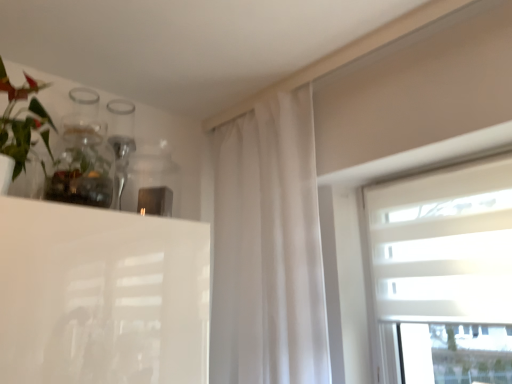
The height and width of the screenshot is (384, 512). Describe the element at coordinates (444, 273) in the screenshot. I see `white textured blinds at upper right` at that location.

The width and height of the screenshot is (512, 384). What do you see at coordinates (268, 248) in the screenshot?
I see `white sheer curtain at center` at bounding box center [268, 248].

What do you see at coordinates (82, 156) in the screenshot? The height and width of the screenshot is (384, 512). I see `clear glass vase at upper left` at bounding box center [82, 156].

You are a GUI agent. You are given a task and a screenshot of the screen. Output one action in this format:
    pyautogui.click(x=<x>, y=<y>)
    Task: Click on the clear glass vase at upper left
    The width and height of the screenshot is (512, 384).
    Given the screenshot: What is the action you would take?
    pyautogui.click(x=82, y=156)

Where is `green matte plant at upper left`? Image resolution: width=512 pixels, height=384 pixels. green matte plant at upper left is located at coordinates (61, 147).

In terms of height, does clear glass vase at upper left look taller or shorter compared to white textured blinds at upper right?

Considering their sizes, clear glass vase at upper left has less height than white textured blinds at upper right.

Measure the distance between clear glass vase at upper left and white textured blinds at upper right.

clear glass vase at upper left is 3.44 feet away from white textured blinds at upper right.

Is clear glass vase at upper left to the left of white textured blinds at upper right from the viewer's perspective?

Correct, you'll find clear glass vase at upper left to the left of white textured blinds at upper right.

Is clear glass vase at upper left located outside white textured blinds at upper right?

Absolutely, clear glass vase at upper left is external to white textured blinds at upper right.

From a real-world perspective, is white sheer curtain at center on top of clear glass vase at upper left?

No.

In the scene shown: Is white sheer curtain at center next to clear glass vase at upper left?

No, white sheer curtain at center is not beside clear glass vase at upper left.

Consider the image. Considering the sizes of objects white sheer curtain at center and clear glass vase at upper left in the image provided, who is thinner, white sheer curtain at center or clear glass vase at upper left?

Thinner between the two is clear glass vase at upper left.

Is clear glass vase at upper left inside white sheer curtain at center?

No, white sheer curtain at center does not contain clear glass vase at upper left.

From a real-world perspective, is clear glass vase at upper left physically below white sheer curtain at center?

No, from a real-world perspective, clear glass vase at upper left is not under white sheer curtain at center.

Is clear glass vase at upper left not close to white sheer curtain at center?

No, clear glass vase at upper left is not far away from white sheer curtain at center.

In the image, is clear glass vase at upper left on the left side or the right side of white sheer curtain at center?

clear glass vase at upper left is to the left of white sheer curtain at center.

Is point (78, 196) behind point (238, 316)?

No, it is in front of (238, 316).

Looking at this image, considering the relative sizes of white textured blinds at upper right and clear glass vase at upper left in the image provided, is white textured blinds at upper right shorter than clear glass vase at upper left?

Incorrect, the height of white textured blinds at upper right does not fall short of that of clear glass vase at upper left.

Is white textured blinds at upper right looking in the opposite direction of clear glass vase at upper left?

white textured blinds at upper right is not turned away from clear glass vase at upper left.

Which is closer to the camera, (415, 237) or (63, 147)?

Clearly, point (415, 237) is more distant from the camera than point (63, 147).

Measure the distance from white textured blinds at upper right to clear glass vase at upper left.

A distance of 1.05 meters exists between white textured blinds at upper right and clear glass vase at upper left.

Locate an element on the screen. This screenshot has height=384, width=512. window that appears below the green matte plant at upper left (from a real-world perspective) is located at coordinates (444, 273).

How many degrees apart are the facing directions of white textured blinds at upper right and green matte plant at upper left?

93.7 degrees separate the facing orientations of white textured blinds at upper right and green matte plant at upper left.

Which is correct: white textured blinds at upper right is inside green matte plant at upper left, or outside of it?

white textured blinds at upper right is spatially situated outside green matte plant at upper left.

Who is smaller, white textured blinds at upper right or green matte plant at upper left?

With smaller size is green matte plant at upper left.

Can you confirm if white sheer curtain at center is positioned to the left of green matte plant at upper left?

Incorrect, white sheer curtain at center is not on the left side of green matte plant at upper left.

Is white sheer curtain at center positioned with its back to green matte plant at upper left?

No, white sheer curtain at center is not facing the opposite direction of green matte plant at upper left.

Which object is closer to the camera, white sheer curtain at center or green matte plant at upper left?

green matte plant at upper left is closer to the camera.

The width and height of the screenshot is (512, 384). Find the location of `window on the right of the green matte plant at upper left`. window on the right of the green matte plant at upper left is located at coordinates (444, 273).

How much distance is there between green matte plant at upper left and white textured blinds at upper right?

They are 1.09 meters apart.

Does point (41, 180) lie behind point (504, 196)?

Yes, point (41, 180) is farther from viewer.

This screenshot has width=512, height=384. In order to click on window lying on the right of clear glass vase at upper left in this screenshot , I will do `click(444, 273)`.

The image size is (512, 384). What are the coordinates of `glass vase located above the white sheer curtain at center (from the image's perspective)` in the screenshot? It's located at (82, 156).

From the image, which object appears to be farther from white textured blinds at upper right, clear glass vase at upper left or green matte plant at upper left?

Based on the image, green matte plant at upper left appears to be further to white textured blinds at upper right.

Considering their positions, is clear glass vase at upper left positioned closer to white sheer curtain at center than green matte plant at upper left?

clear glass vase at upper left is positioned closer to the anchor white sheer curtain at center.

Based on their spatial positions, is white textured blinds at upper right or clear glass vase at upper left further from white sheer curtain at center?

Based on the image, clear glass vase at upper left appears to be further to white sheer curtain at center.

Looking at the image, which one is located closer to white sheer curtain at center, green matte plant at upper left or clear glass vase at upper left?

The object closer to white sheer curtain at center is clear glass vase at upper left.

Based on their spatial positions, is white sheer curtain at center or white textured blinds at upper right further from green matte plant at upper left?

Among the two, white textured blinds at upper right is located further to green matte plant at upper left.

Which object lies further to the anchor point green matte plant at upper left, white textured blinds at upper right or white sheer curtain at center?

Result: white textured blinds at upper right is further to green matte plant at upper left.

When comparing their distances from white textured blinds at upper right, does white sheer curtain at center or green matte plant at upper left seem closer?

Among the two, white sheer curtain at center is located nearer to white textured blinds at upper right.

Considering their positions, is white sheer curtain at center positioned further to clear glass vase at upper left than green matte plant at upper left?

white sheer curtain at center is positioned further to the anchor clear glass vase at upper left.

The height and width of the screenshot is (384, 512). I want to click on glass vase between green matte plant at upper left and white sheer curtain at center in the horizontal direction, so click(82, 156).

I want to click on curtain between green matte plant at upper left and white textured blinds at upper right in the horizontal direction, so coord(268,248).

Locate an element on the screen. This screenshot has width=512, height=384. glass vase between green matte plant at upper left and white textured blinds at upper right from left to right is located at coordinates (82, 156).

Locate an element on the screen. The image size is (512, 384). curtain between clear glass vase at upper left and white textured blinds at upper right is located at coordinates (268, 248).